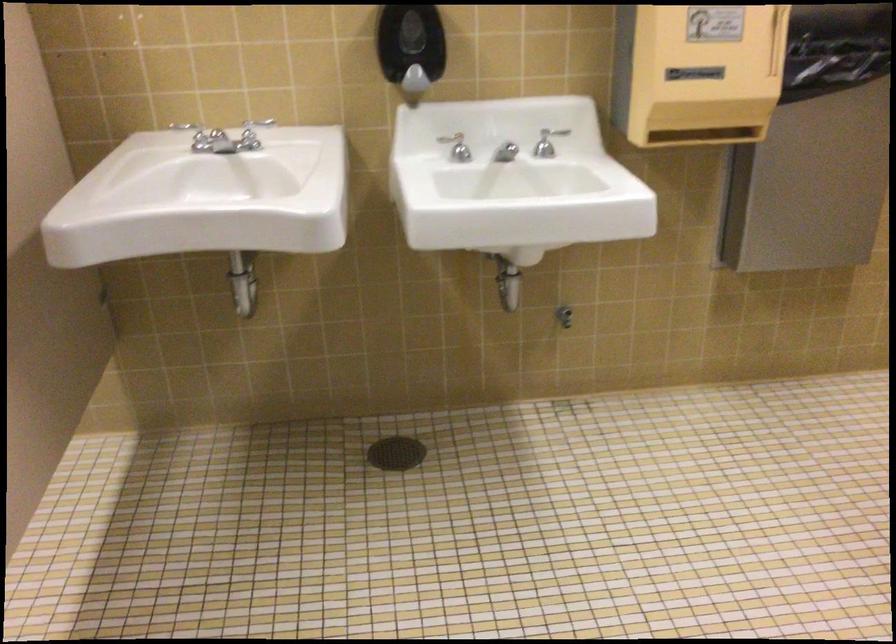
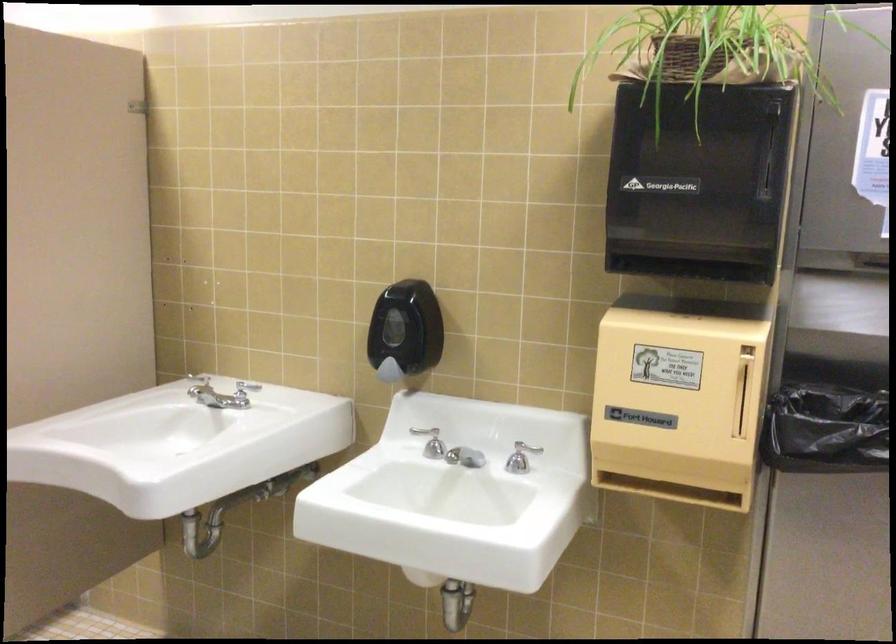
Find the pixel in the second image that matches the point at 538,147 in the first image.

(521, 458)